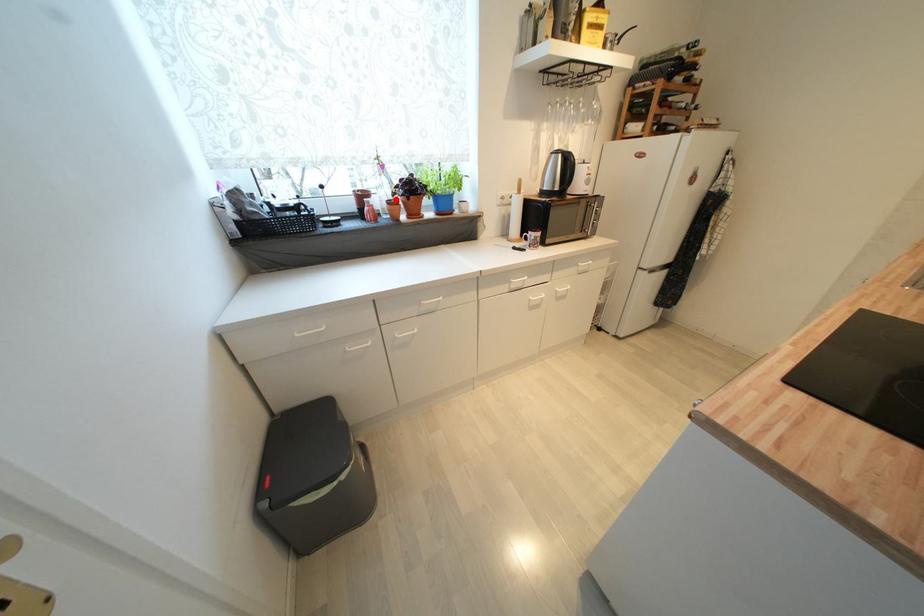
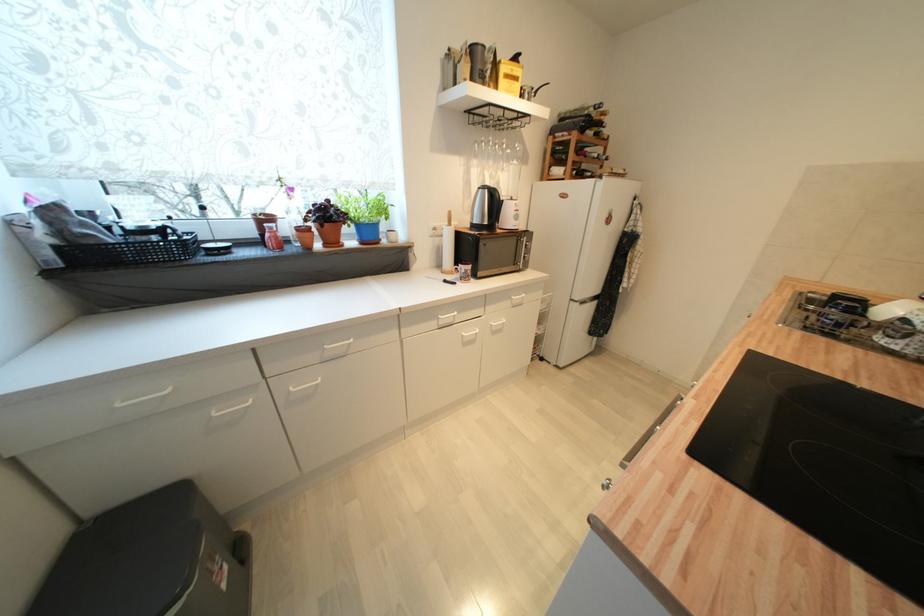
Where in the second image is the point corresponding to the highlighted location from the first image?

(306, 225)